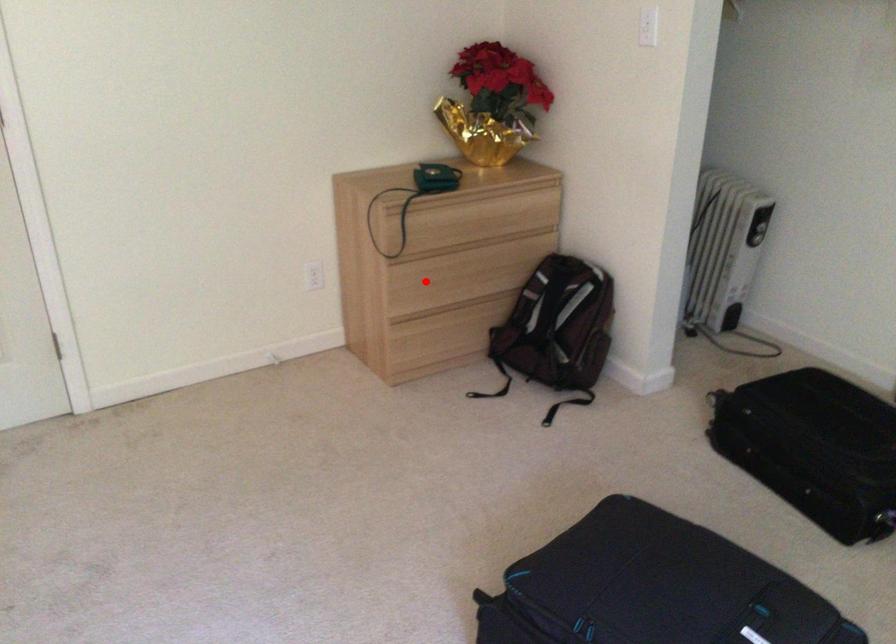
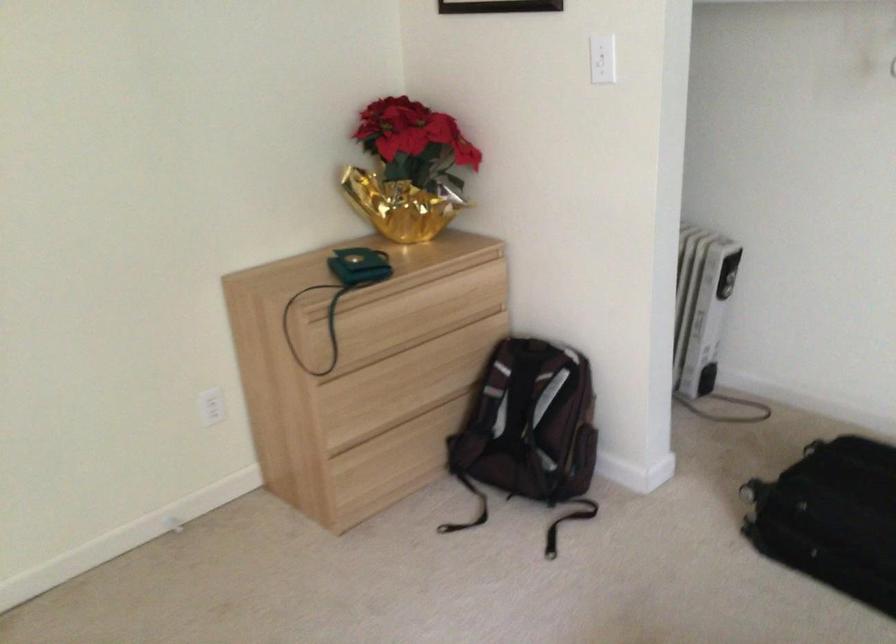
Question: I am providing you with two images of the same scene from different viewpoints. Image1 has a red point marked. In image2, the corresponding 3D location appears at what relative position? Reply with the corresponding letter.

Choices:
 (A) Closer
 (B) Farther

Answer: (A)